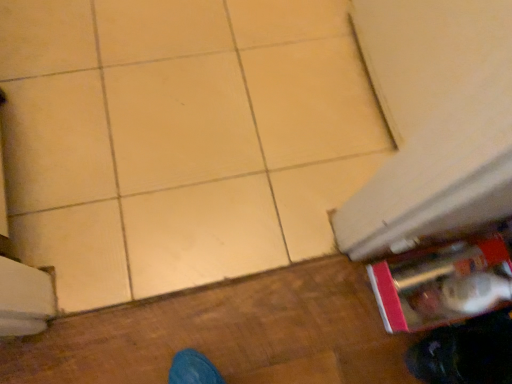
The image size is (512, 384). In order to click on blank space to the left of black matte shoe at lower right in this screenshot , I will do `click(370, 330)`.